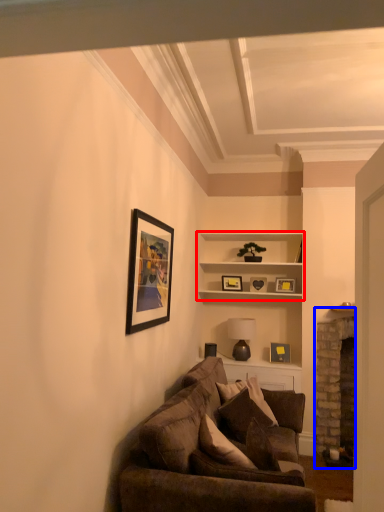
Question: Which point is closer to the camera, shelf (highlighted by a red box) or fireplace (highlighted by a blue box)?

Choices:
 (A) shelf
 (B) fireplace

Answer: (B)